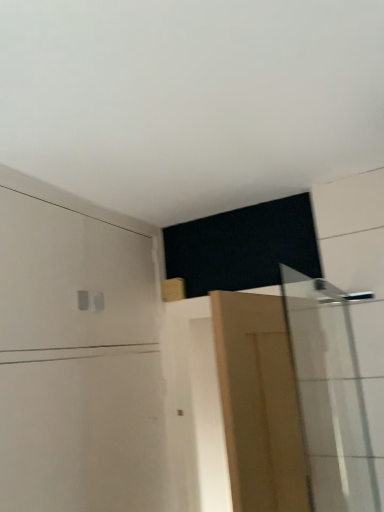
In order to click on light brown wooden door at center in this screenshot , I will do `click(259, 404)`.

Based on the photo, is white glossy shower door at right oriented towards white matte dresser at upper left?

No, white glossy shower door at right is not oriented towards white matte dresser at upper left.

Is white glossy shower door at right shorter than white matte dresser at upper left?

Indeed, white glossy shower door at right has a lesser height compared to white matte dresser at upper left.

Is white glossy shower door at right far from white matte dresser at upper left?

That's not correct — white glossy shower door at right is a little close to white matte dresser at upper left.

Consider the image. From the image's perspective, does white matte dresser at upper left appear higher than light brown wooden door at center?

Yes.

Considering the positions of objects white matte dresser at upper left and light brown wooden door at center in the image provided, who is behind, white matte dresser at upper left or light brown wooden door at center?

white matte dresser at upper left is further away from the camera.

Is white matte dresser at upper left inside or outside of light brown wooden door at center?

white matte dresser at upper left is not enclosed by light brown wooden door at center.

From the image's perspective, is light brown wooden door at center located beneath white matte dresser at upper left?

Yes.

Find the location of a particular element. The image size is (384, 512). dresser on the left of light brown wooden door at center is located at coordinates (77, 362).

Which object is thinner, light brown wooden door at center or white matte dresser at upper left?

With smaller width is light brown wooden door at center.

Who is smaller, white matte dresser at upper left or white glossy shower door at right?

white glossy shower door at right is smaller.

Between white matte dresser at upper left and white glossy shower door at right, which one has larger width?

white matte dresser at upper left is wider.

Does point (22, 203) appear closer or farther from the camera than point (317, 378)?

Point (22, 203) is closer to the camera than point (317, 378).

From a real-world perspective, which is physically below, light brown wooden door at center or white glossy shower door at right?

light brown wooden door at center.

Is light brown wooden door at center positioned far away from white glossy shower door at right?

They are positioned close to each other.

From the image's perspective, does light brown wooden door at center appear lower than white glossy shower door at right?

Yes, from the image's perspective, light brown wooden door at center is beneath white glossy shower door at right.

In terms of size, does light brown wooden door at center appear bigger or smaller than white glossy shower door at right?

light brown wooden door at center is bigger than white glossy shower door at right.

Considering the relative sizes of white glossy shower door at right and light brown wooden door at center in the image provided, is white glossy shower door at right taller than light brown wooden door at center?

Yes.

Is white glossy shower door at right oriented away from light brown wooden door at center?

No, light brown wooden door at center is not at the back of white glossy shower door at right.

Is white glossy shower door at right not close to light brown wooden door at center?

Actually, white glossy shower door at right and light brown wooden door at center are a little close together.

From the image's perspective, who appears lower, white glossy shower door at right or light brown wooden door at center?

light brown wooden door at center appears lower in the image.

This screenshot has height=512, width=384. I want to click on dresser on the left of white glossy shower door at right, so click(77, 362).

This screenshot has height=512, width=384. I want to click on dresser that appears above the light brown wooden door at center (from the image's perspective), so (77, 362).

Estimate the real-world distances between objects in this image. Which object is closer to white glossy shower door at right, white matte dresser at upper left or light brown wooden door at center?

Among the two, light brown wooden door at center is located nearer to white glossy shower door at right.

Estimate the real-world distances between objects in this image. Which object is further from white glossy shower door at right, light brown wooden door at center or white matte dresser at upper left?

white matte dresser at upper left is positioned further to the anchor white glossy shower door at right.

Considering their positions, is white matte dresser at upper left positioned further to light brown wooden door at center than white glossy shower door at right?

Among the two, white matte dresser at upper left is located further to light brown wooden door at center.

Considering their positions, is white glossy shower door at right positioned further to white matte dresser at upper left than light brown wooden door at center?

Among the two, white glossy shower door at right is located further to white matte dresser at upper left.

Which object lies nearer to the anchor point white matte dresser at upper left, light brown wooden door at center or white glossy shower door at right?

The object closer to white matte dresser at upper left is light brown wooden door at center.

Based on their spatial positions, is white glossy shower door at right or white matte dresser at upper left closer to light brown wooden door at center?

white glossy shower door at right is closer to light brown wooden door at center.

Find the location of a particular element. Image resolution: width=384 pixels, height=512 pixels. door between white matte dresser at upper left and white glossy shower door at right is located at coordinates (259, 404).